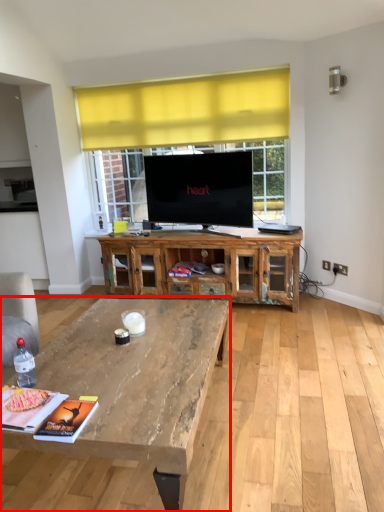
Question: In this image, where is coffee table (annotated by the red box) located relative to cabinetry?

Choices:
 (A) right
 (B) left

Answer: (B)